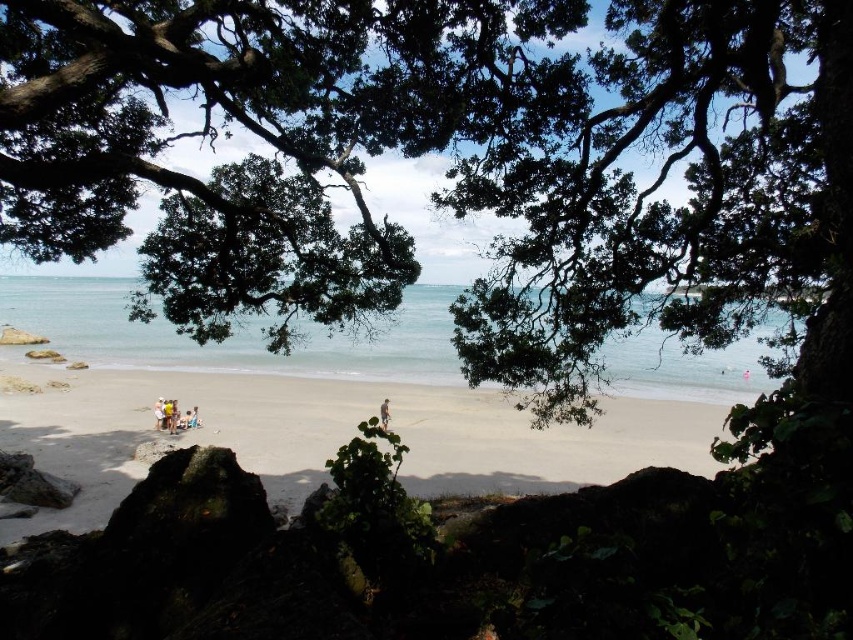
You are setting up a photography session at the beach and need to place two identical light brown wooden chairs. You have the light brown wooden chair at lower left and the light brown wooden chair at center. Which chair has a greater width?

The light brown wooden chair at lower left has a greater width than the light brown wooden chair at center.

You are sitting on the light brown wooden chair at lower left and want to look at the clear blue water at center. Which direction should you turn your head to see it?

The clear blue water at center is in front of the light brown wooden chair at lower left, so you don not need to turn your head. Just look straight ahead.

You are planning to set up a small beach umbrella between the clear blue water at center and the light brown wooden chair at lower left. Based on their widths, which object should you place the umbrella closer to to ensure it doesn

The clear blue water at center is wider than the light brown wooden chair at lower left. To ensure the umbrella is placed in a wider area, you should position it closer to the clear blue water at center.